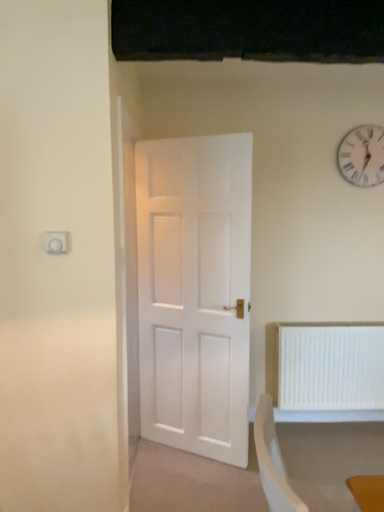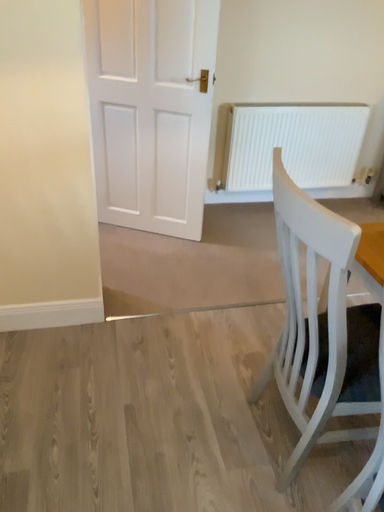
Question: Which way did the camera rotate in the video?

Choices:
 (A) rotated right
 (B) rotated left

Answer: (A)